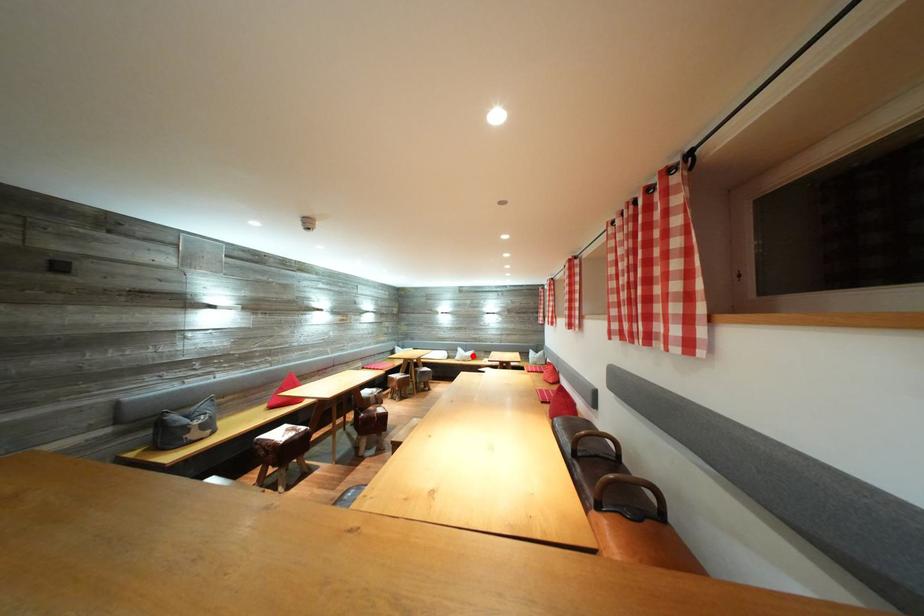
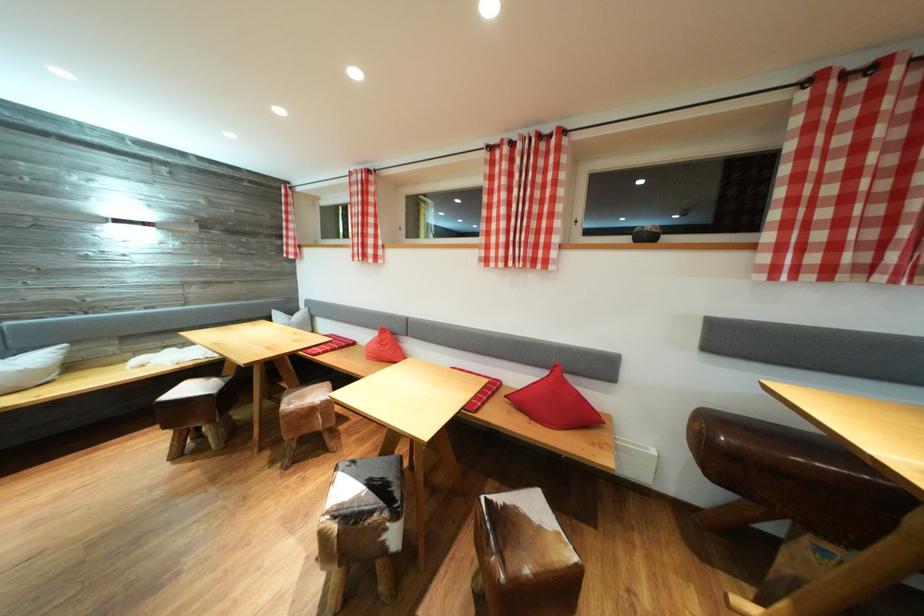
Question: I am providing you with two images of the same scene from different viewpoints. Image1 has a red point marked. In image2, the corresponding 3D location appears at what relative position? Reply with the corresponding letter.

Choices:
 (A) Closer
 (B) Farther

Answer: (A)